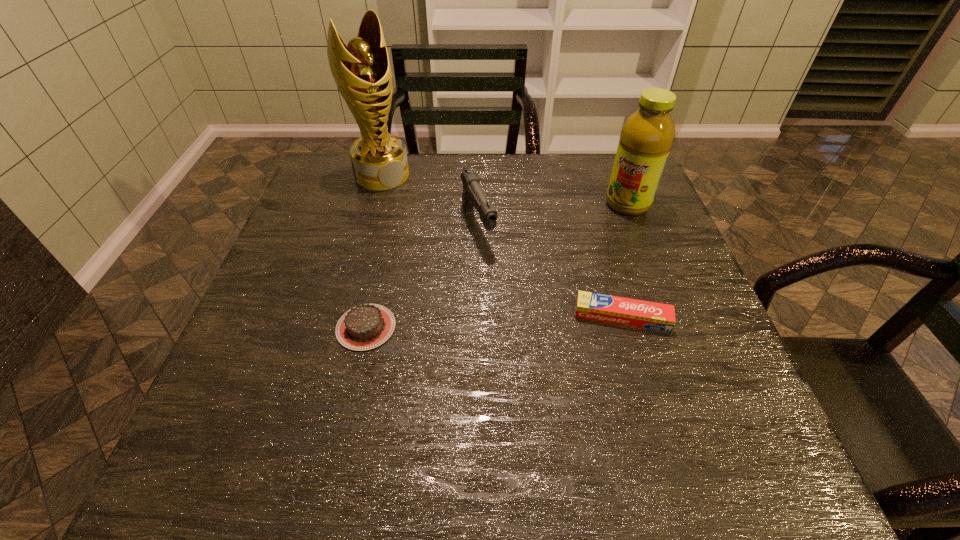
You are a GUI agent. You are given a task and a screenshot of the screen. Output one action in this format:
    pyautogui.click(x=<x>, y=<y>)
    Task: Click on the chocolate cake
    The height and width of the screenshot is (540, 960).
    Given the screenshot: What is the action you would take?
    pyautogui.click(x=367, y=326)

Where is `toothpaste`? toothpaste is located at coordinates (625, 311).

The width and height of the screenshot is (960, 540). I want to click on the tallest object, so click(x=362, y=72).

The height and width of the screenshot is (540, 960). I want to click on gun, so [473, 196].

Where is `the third object from left to right`? The height and width of the screenshot is (540, 960). the third object from left to right is located at coordinates (473, 196).

Where is `fruit juice`? This screenshot has width=960, height=540. fruit juice is located at coordinates (647, 135).

You are a GUI agent. You are given a task and a screenshot of the screen. Output one action in this format:
    pyautogui.click(x=<x>, y=<y>)
    Task: Click on the free space located 0.200m on the right of the chocolate cake
    This screenshot has height=540, width=960.
    Given the screenshot: What is the action you would take?
    pyautogui.click(x=493, y=327)

At what (x,y) coordinates should I click in order to perform the action: click on vacant space located on the back of the toothpaste. Please return your answer as a coordinate pair (x, y). Looking at the image, I should click on (594, 219).

At what (x,y) coordinates should I click in order to perform the action: click on free location located 0.110m on the front-facing side of the award. Please return your answer as a coordinate pair (x, y). The height and width of the screenshot is (540, 960). Looking at the image, I should click on (415, 207).

Find the location of a particular element. vacant area situated 0.100m on the front-facing side of the award is located at coordinates pos(413,205).